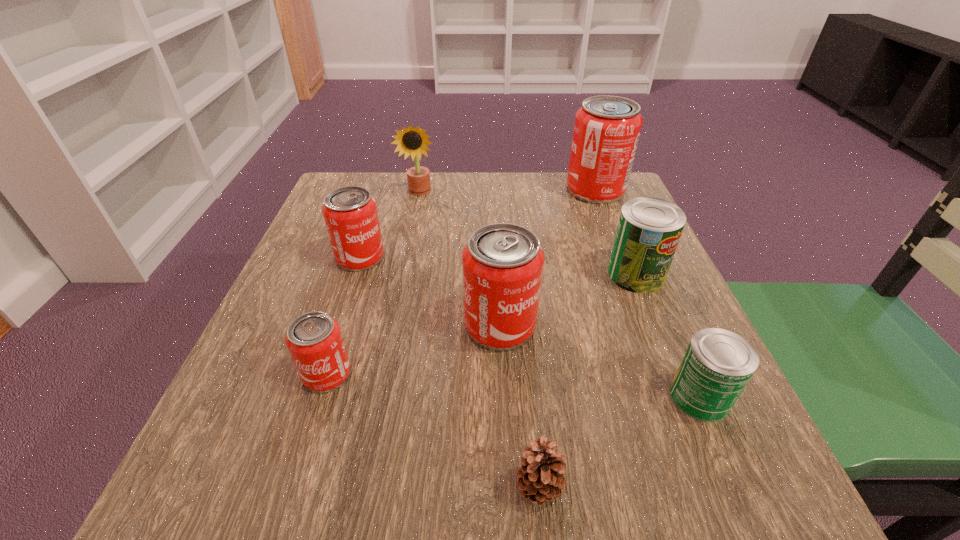
You are a GUI agent. You are given a task and a screenshot of the screen. Output one action in this format:
    pyautogui.click(x=<x>, y=<y>)
    Task: Click on the object present at the near edge
    
    Given the screenshot: What is the action you would take?
    pyautogui.click(x=541, y=478)

Locate an element on the screen. object located at the far right corner is located at coordinates (606, 132).

This screenshot has height=540, width=960. I want to click on vacant point at the far edge, so click(x=522, y=183).

Image resolution: width=960 pixels, height=540 pixels. I want to click on vacant space at the near edge of the desktop, so click(388, 465).

This screenshot has width=960, height=540. In order to click on vacant region at the left edge in this screenshot , I will do point(339,274).

This screenshot has width=960, height=540. What are the coordinates of `vacant area at the far right corner of the desktop` in the screenshot? It's located at (592, 208).

This screenshot has height=540, width=960. I want to click on empty space that is in between the pinecone and the farther green can, so click(588, 381).

This screenshot has height=540, width=960. What are the coordinates of `free space between the smaller green can and the nearest red can` in the screenshot? It's located at (514, 386).

You are a GUI agent. You are given a task and a screenshot of the screen. Output one action in this format:
    pyautogui.click(x=<x>, y=<y>)
    Task: Click on the vacant area between the fifth shortest can and the farther green can
    The height and width of the screenshot is (540, 960).
    Given the screenshot: What is the action you would take?
    pyautogui.click(x=568, y=299)

Locate an element on the screen. This screenshot has height=540, width=960. vacant space that's between the bigger green can and the nearer green can is located at coordinates (668, 335).